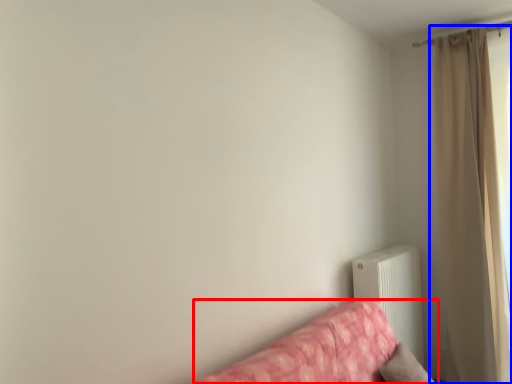
Question: Which of the following is the farthest to the observer, studio couch (highlighted by a red box) or curtain (highlighted by a blue box)?

Choices:
 (A) studio couch
 (B) curtain

Answer: (B)